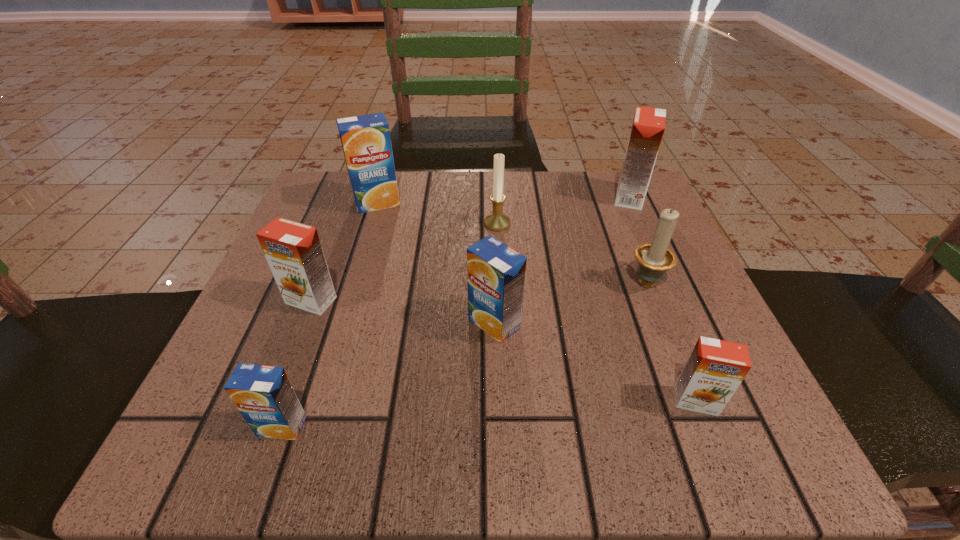
Locate an element on the screen. blank space located on the back of the nearest blue orange_juice is located at coordinates (351, 230).

This screenshot has width=960, height=540. Find the location of `candle holder at the far edge`. candle holder at the far edge is located at coordinates (497, 221).

Identify the location of candle_holder that is at the right edge. (654, 258).

The height and width of the screenshot is (540, 960). Find the location of `object located in the far left corner section of the desktop`. object located in the far left corner section of the desktop is located at coordinates (366, 142).

This screenshot has width=960, height=540. Find the location of `object at the near left corner`. object at the near left corner is located at coordinates [263, 394].

At what (x,y) coordinates should I click in order to perform the action: click on object at the far right corner. Please return your answer as a coordinate pair (x, y). The height and width of the screenshot is (540, 960). Looking at the image, I should click on (648, 127).

What are the coordinates of `object that is positioned at the near right corner` in the screenshot? It's located at (715, 369).

The image size is (960, 540). In order to click on vacant region at the far edge in this screenshot , I will do `click(532, 210)`.

The image size is (960, 540). In the image, there is a desktop. Find the location of `vacant space at the near edge`. vacant space at the near edge is located at coordinates (622, 411).

Find the location of a particular element. Image resolution: width=960 pixels, height=540 pixels. blank space at the left edge of the desktop is located at coordinates (347, 262).